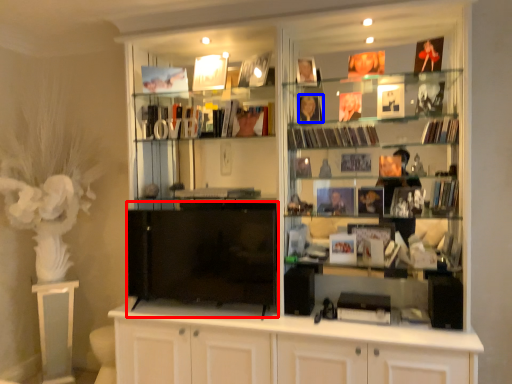
Question: Which object is further to the camera taking this photo, wide (highlighted by a red box) or book (highlighted by a blue box)?

Choices:
 (A) wide
 (B) book

Answer: (B)